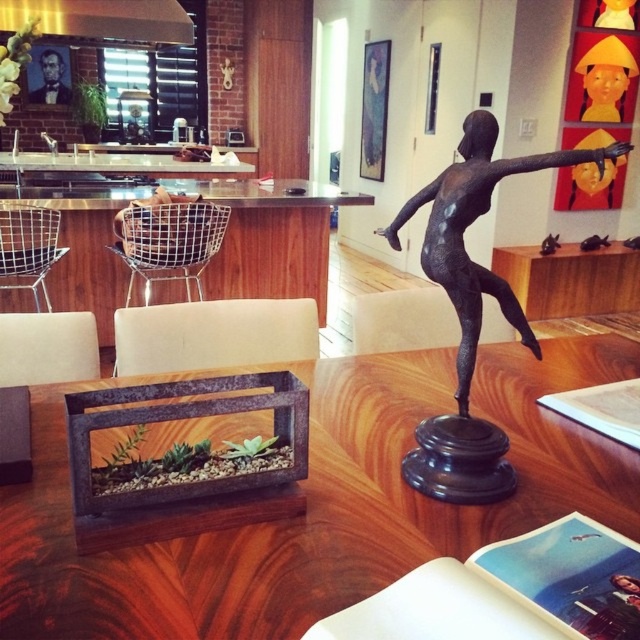
Question: Considering the real-world distances, which object is closest to the bronze statue at center?

Choices:
 (A) wooden table at center
 (B) matte black chair at center

Answer: (A)

Question: Which of the following is the closest to the observer?

Choices:
 (A) matte black chair at center
 (B) metal mesh chair at center
 (C) wire mesh chair at left

Answer: (A)

Question: Is brown leather chair at center to the right of smooth black portrait at upper left from the viewer's perspective?

Choices:
 (A) no
 (B) yes

Answer: (B)

Question: Can you confirm if bronze statue at center is smaller than yellow paper hat at upper right?

Choices:
 (A) no
 (B) yes

Answer: (A)

Question: Is wooden table at center to the left of beige fabric chair at center from the viewer's perspective?

Choices:
 (A) yes
 (B) no

Answer: (B)

Question: Which object appears farthest from the camera in this image?

Choices:
 (A) metal mesh chair at center
 (B) bronze statue at center

Answer: (A)